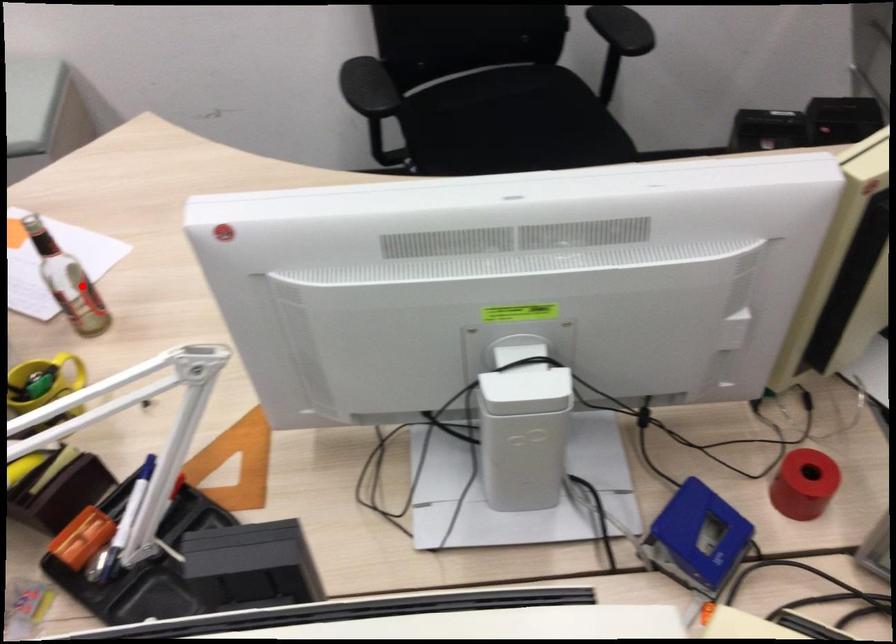
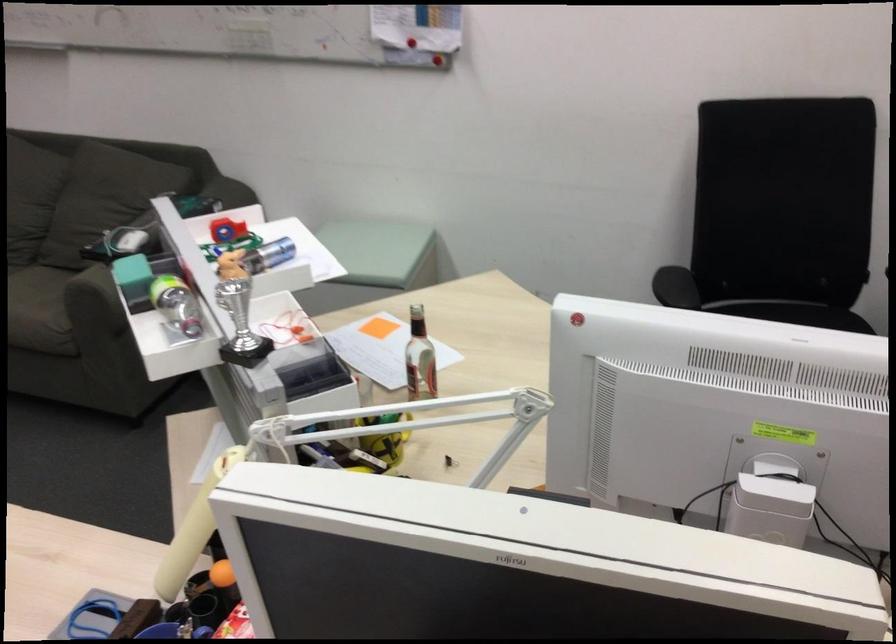
Question: I am providing you with two images of the same scene from different viewpoints. In image1, a red point is highlighted. Considering the same 3D point in image2, which of the following is correct?

Choices:
 (A) It is closer
 (B) It is farther

Answer: (B)